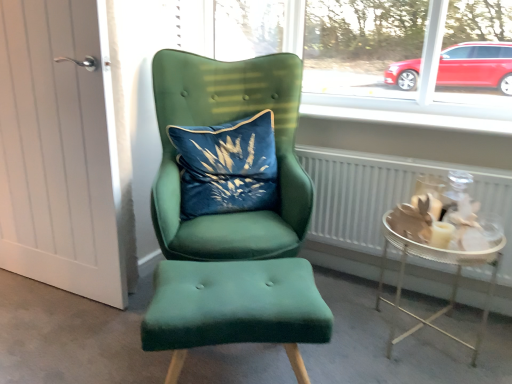
Where is `free point below white textured radiator at lower right (from a real-world perspective)`? free point below white textured radiator at lower right (from a real-world perspective) is located at coordinates (385, 279).